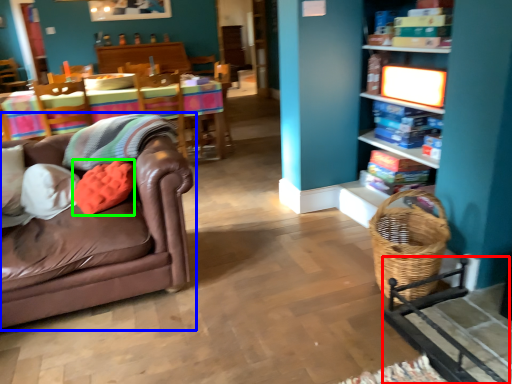
Question: Estimate the real-world distances between objects in this image. Which object is farther from rocking chair (highlighted by a red box), studio couch (highlighted by a blue box) or pillow (highlighted by a green box)?

Choices:
 (A) studio couch
 (B) pillow

Answer: (B)